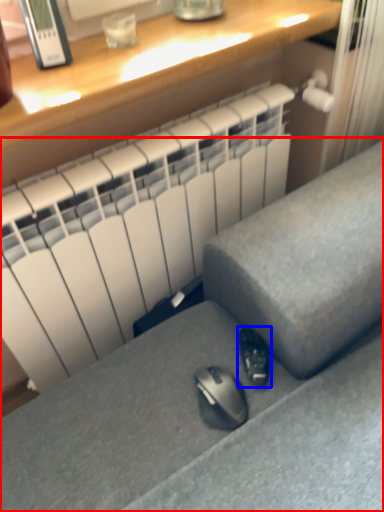
Question: Which object appears farthest to the camera in this image, furniture (highlighted by a red box) or shoe (highlighted by a blue box)?

Choices:
 (A) furniture
 (B) shoe

Answer: (B)